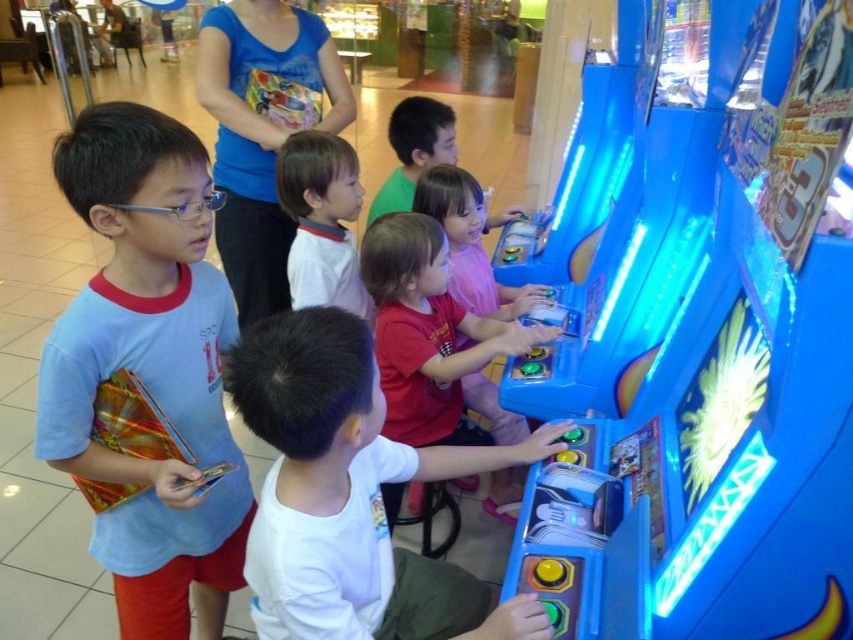
You are standing in the shopping mall and want to know which of the two points, point (468, 580) or point (352, 218), is closer to you. Based on the scene, can you determine this?

Point (468, 580) is closer to the viewer than point (352, 218).